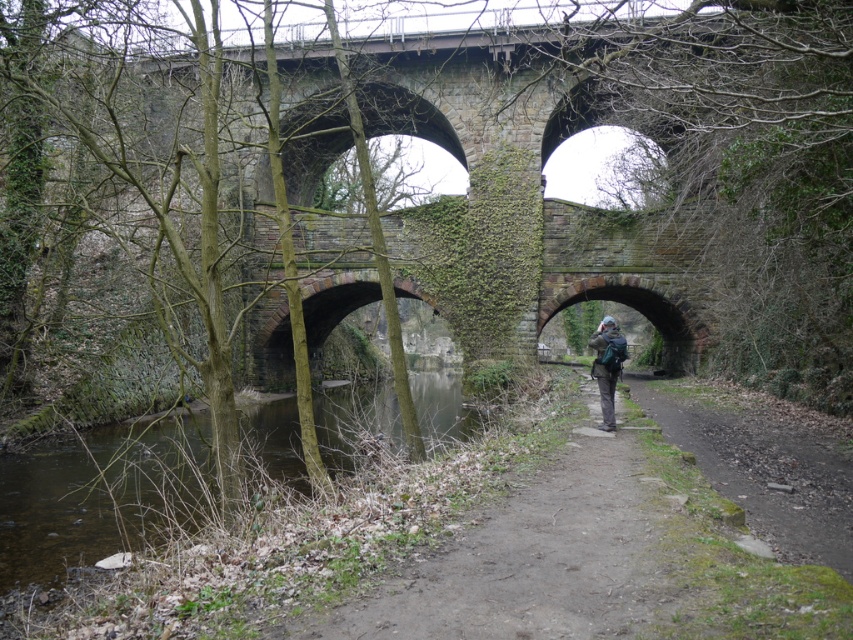
Which is behind, point (830, 458) or point (612, 376)?

The point (612, 376) is behind.

Who is positioned more to the right, brown dirt path at lower right or green backpack at center?

Positioned to the right is green backpack at center.

Does point (750, 432) come behind point (618, 360)?

Yes, it is.

Image resolution: width=853 pixels, height=640 pixels. What are the coordinates of `brown dirt path at lower right` in the screenshot? It's located at (763, 461).

Is dirt path at center closer to camera compared to brown dirt path at lower right?

Yes, dirt path at center is in front of brown dirt path at lower right.

Who is more distant from viewer, (x=572, y=592) or (x=758, y=497)?

Positioned behind is point (x=758, y=497).

Locate an element on the screen. This screenshot has width=853, height=640. dirt path at center is located at coordinates (538, 556).

Does point (662, 573) lie behind point (608, 360)?

No, it is not.

Which is behind, point (457, 545) or point (595, 371)?

Positioned behind is point (595, 371).

Is point (430, 564) more distant than point (613, 328)?

No.

I want to click on dirt path at center, so click(538, 556).